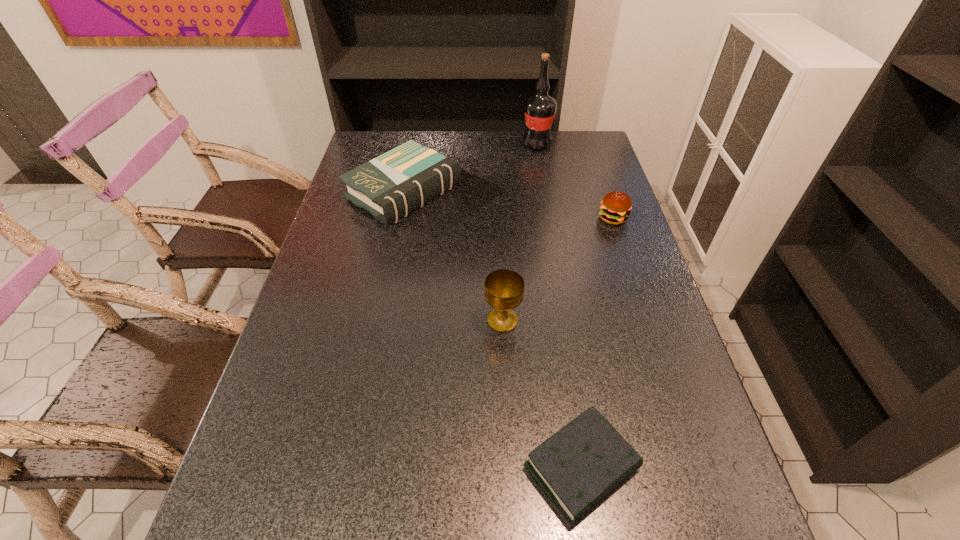
Where is `vacant region that satisfies the following two spatial constraints: 1. on the back side of the tallest object; 2. on the left side of the fourth shortest object`? vacant region that satisfies the following two spatial constraints: 1. on the back side of the tallest object; 2. on the left side of the fourth shortest object is located at coordinates (494, 144).